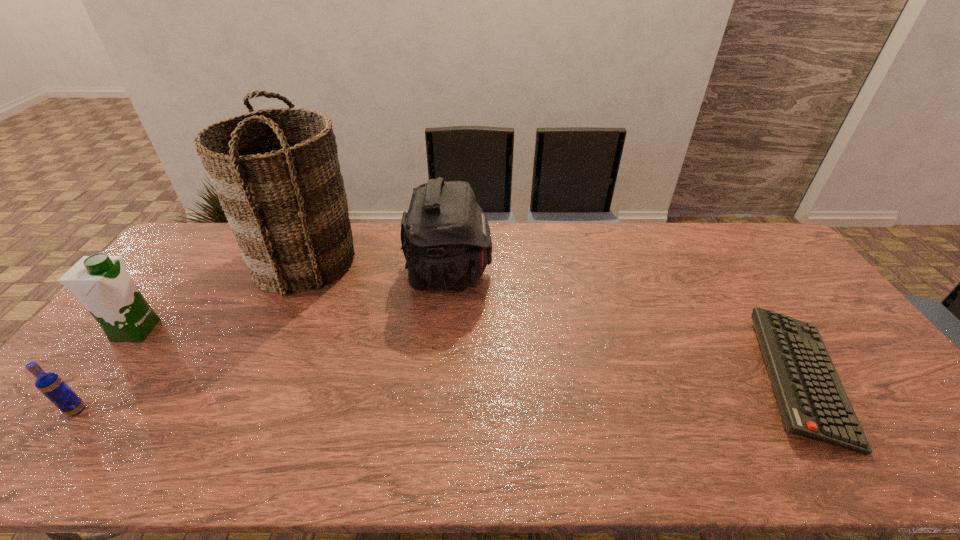
Locate an element on the screen. free space at the far edge of the desktop is located at coordinates (665, 244).

The width and height of the screenshot is (960, 540). Identify the location of blank space at the near edge of the desktop. click(x=370, y=435).

Where is `free spot at the left edge of the desktop`? free spot at the left edge of the desktop is located at coordinates (132, 356).

Identify the location of vacant area at the far right corner of the desktop. The height and width of the screenshot is (540, 960). (732, 237).

Locate an element on the screen. This screenshot has width=960, height=540. free area in between the computer keyboard and the fourth tallest object is located at coordinates (438, 394).

Image resolution: width=960 pixels, height=540 pixels. I want to click on vacant space that is in between the third tallest object and the basket, so click(x=221, y=295).

The width and height of the screenshot is (960, 540). I want to click on vacant space in between the vodka and the third object from left to right, so click(191, 335).

Locate an element on the screen. The height and width of the screenshot is (540, 960). free space between the computer keyboard and the soya milk is located at coordinates (468, 354).

Locate an element on the screen. The image size is (960, 540). blank region between the soya milk and the computer keyboard is located at coordinates (468, 354).

Image resolution: width=960 pixels, height=540 pixels. In order to click on vacant area that lies between the shortest object and the tallest object in this screenshot , I will do `click(553, 320)`.